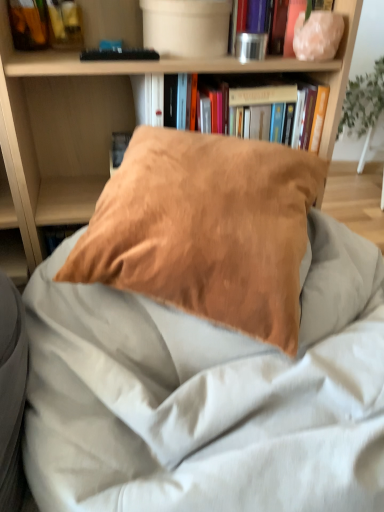
Locate an element on the screen. This screenshot has width=384, height=512. suede-like brown pillow at center is located at coordinates (206, 229).

You are a GUI agent. You are given a task and a screenshot of the screen. Output one action in this format:
    pyautogui.click(x=<x>, y=<y>)
    Task: Click on the hardcover book at upper center, placed as the second book when sorted from top to bottom
    This screenshot has height=512, width=384.
    Given the screenshot: What is the action you would take?
    pyautogui.click(x=312, y=117)

Image resolution: width=384 pixels, height=512 pixels. What do you see at coordinates (363, 101) in the screenshot?
I see `green leafy plant at upper right` at bounding box center [363, 101].

This screenshot has height=512, width=384. I want to click on suede-like brown pillow at center, so click(x=206, y=229).

Could you tell me if suede-like brown pillow at center is turned towards suede-like brown pillow at center?

No, suede-like brown pillow at center is not facing towards suede-like brown pillow at center.

Can you confirm if suede-like brown pillow at center is positioned to the right of suede-like brown pillow at center?

Correct, you'll find suede-like brown pillow at center to the right of suede-like brown pillow at center.

Between suede-like brown pillow at center and suede-like brown pillow at center, which one has smaller width?

suede-like brown pillow at center is thinner.

Consider the image. Is suede-like brown pillow at center closer to the viewer compared to hardcover book at upper center, placed as the second book when sorted from top to bottom?

Yes.

Where is `the 1st book counting from the right side of the suede-like brown pillow at center`? The width and height of the screenshot is (384, 512). the 1st book counting from the right side of the suede-like brown pillow at center is located at coordinates (312, 117).

From a real-world perspective, is suede-like brown pillow at center positioned under hardcover book at upper center, which appears as the 1th book when ordered from the bottom, based on gravity?

Yes.

Does point (360, 84) come farther from viewer compared to point (310, 117)?

Yes, it is behind point (310, 117).

Considering the sizes of objects green leafy plant at upper right and hardcover book at upper center, placed as the second book when sorted from top to bottom, in the image provided, who is smaller, green leafy plant at upper right or hardcover book at upper center, placed as the second book when sorted from top to bottom,?

hardcover book at upper center, placed as the second book when sorted from top to bottom, is smaller.

Considering the positions of objects green leafy plant at upper right and hardcover book at upper center, which appears as the 1th book when ordered from the bottom, in the image provided, who is more to the left, green leafy plant at upper right or hardcover book at upper center, which appears as the 1th book when ordered from the bottom,?

Positioned to the left is hardcover book at upper center, which appears as the 1th book when ordered from the bottom.

Who is shorter, matte brown pillow at center or suede-like brown pillow at center?

suede-like brown pillow at center.

Identify the location of bed below the matte brown pillow at center (from the image's perspective). The image size is (384, 512). (207, 340).

Considering the relative sizes of matte brown pillow at center and suede-like brown pillow at center in the image provided, is matte brown pillow at center thinner than suede-like brown pillow at center?

Incorrect, the width of matte brown pillow at center is not less than that of suede-like brown pillow at center.

Does point (281, 211) appear closer or farther from the camera than point (282, 26)?

Point (281, 211) is closer to the camera than point (282, 26).

From the picture: Is suede-like brown pillow at center far from metallic silver canister at upper center, arranged as the second book when ordered from the bottom?

No, there isn't a large distance between suede-like brown pillow at center and metallic silver canister at upper center, arranged as the second book when ordered from the bottom.

Which point is more distant from viewer, (98, 138) or (316, 134)?

The point (98, 138) is farther.

Who is bigger, matte brown pillow at center or hardcover book at upper center, placed as the second book when sorted from top to bottom?

Bigger between the two is matte brown pillow at center.

At what (x,y) coordinates should I click in order to perform the action: click on bookcase on the left of hardcover book at upper center, which appears as the 1th book when ordered from the bottom. Please return your answer as a coordinate pair (x, y). The height and width of the screenshot is (512, 384). Looking at the image, I should click on (103, 120).

How many degrees apart are the facing directions of matte brown pillow at center and hardcover book at upper center, which appears as the 1th book when ordered from the bottom?

matte brown pillow at center and hardcover book at upper center, which appears as the 1th book when ordered from the bottom, are facing 90.8 degrees away from each other.

Is green leafy plant at upper right taller than matte brown pillow at center?

Incorrect, the height of green leafy plant at upper right is not larger of that of matte brown pillow at center.

Is there a large distance between green leafy plant at upper right and matte brown pillow at center?

Yes, green leafy plant at upper right and matte brown pillow at center are located far from each other.

Is matte brown pillow at center completely or partially inside green leafy plant at upper right?

That's incorrect, matte brown pillow at center is not inside green leafy plant at upper right.

Locate an element on the screen. Image resolution: width=384 pixels, height=512 pixels. plant below the matte brown pillow at center (from a real-world perspective) is located at coordinates (363, 101).

Where is `pillow that is above the suede-like brown pillow at center (from a real-world perspective)`? The image size is (384, 512). pillow that is above the suede-like brown pillow at center (from a real-world perspective) is located at coordinates (206, 229).

From the suede-like brown pillow at center, count 2nd books backward and point to it. Please provide its 2D coordinates.

[(312, 117)]

Based on their spatial positions, is matte brown pillow at center or green leafy plant at upper right closer to suede-like brown pillow at center?

matte brown pillow at center is positioned closer to the anchor suede-like brown pillow at center.

Looking at the image, which one is located closer to metallic silver canister at upper center, arranged as the second book when ordered from the bottom, matte brown pillow at center or green leafy plant at upper right?

matte brown pillow at center is positioned closer to the anchor metallic silver canister at upper center, arranged as the second book when ordered from the bottom.

Estimate the real-world distances between objects in this image. Which object is further from hardcover book at upper center, placed as the second book when sorted from top to bottom, suede-like brown pillow at center or green leafy plant at upper right?

green leafy plant at upper right lies further to hardcover book at upper center, placed as the second book when sorted from top to bottom, than the other object.

Looking at the image, which one is located further to suede-like brown pillow at center, metallic silver canister at upper center, arranged as the second book when ordered from the bottom, or matte brown pillow at center?

Based on the image, metallic silver canister at upper center, arranged as the second book when ordered from the bottom, appears to be further to suede-like brown pillow at center.

From the image, which object appears to be farther from metallic silver canister at upper center, arranged as the second book when ordered from the bottom, suede-like brown pillow at center or green leafy plant at upper right?

The object further to metallic silver canister at upper center, arranged as the second book when ordered from the bottom, is green leafy plant at upper right.

From the image, which object appears to be farther from green leafy plant at upper right, suede-like brown pillow at center or matte brown pillow at center?

The object further to green leafy plant at upper right is suede-like brown pillow at center.

Considering their positions, is suede-like brown pillow at center positioned closer to suede-like brown pillow at center than hardcover book at upper center, which appears as the 1th book when ordered from the bottom?

Among the two, suede-like brown pillow at center is located nearer to suede-like brown pillow at center.

From the image, which object appears to be nearer to hardcover book at upper center, which appears as the 1th book when ordered from the bottom, matte brown pillow at center or metallic silver canister at upper center, the first book when ordered from top to bottom?

Among the two, metallic silver canister at upper center, the first book when ordered from top to bottom, is located nearer to hardcover book at upper center, which appears as the 1th book when ordered from the bottom.

Image resolution: width=384 pixels, height=512 pixels. What are the coordinates of `bookcase between suede-like brown pillow at center and hardcover book at upper center, which appears as the 1th book when ordered from the bottom, along the z-axis` in the screenshot? It's located at (103, 120).

Image resolution: width=384 pixels, height=512 pixels. I want to click on bookcase positioned between suede-like brown pillow at center and hardcover book at upper center, placed as the second book when sorted from top to bottom, from near to far, so click(x=103, y=120).

What are the coordinates of `bookcase between suede-like brown pillow at center and green leafy plant at upper right from front to back` in the screenshot? It's located at (103, 120).

Locate an element on the screen. This screenshot has width=384, height=512. book between metallic silver canister at upper center, arranged as the second book when ordered from the bottom, and green leafy plant at upper right, along the z-axis is located at coordinates click(x=312, y=117).